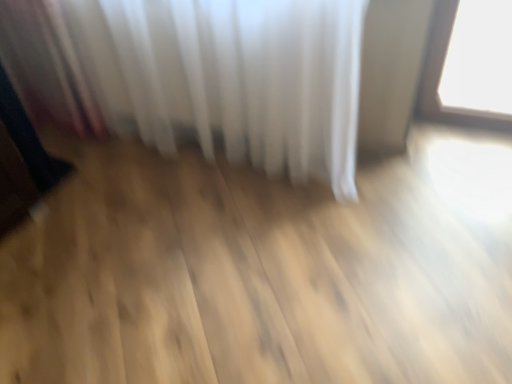
Question: From a real-world perspective, is metallic reflective object at left physically located above or below white sheer curtain at upper center?

Choices:
 (A) below
 (B) above

Answer: (A)

Question: In terms of height, does metallic reflective object at left look taller or shorter compared to white sheer curtain at upper center?

Choices:
 (A) tall
 (B) short

Answer: (B)

Question: Does point (10, 210) appear closer or farther from the camera than point (229, 46)?

Choices:
 (A) closer
 (B) farther

Answer: (B)

Question: Would you say white sheer curtain at upper center is to the left or to the right of metallic reflective object at left in the picture?

Choices:
 (A) left
 (B) right

Answer: (B)

Question: In terms of width, does white sheer curtain at upper center look wider or thinner when compared to metallic reflective object at left?

Choices:
 (A) thin
 (B) wide

Answer: (B)

Question: Considering the positions of white sheer curtain at upper center and metallic reflective object at left in the image, is white sheer curtain at upper center bigger or smaller than metallic reflective object at left?

Choices:
 (A) small
 (B) big

Answer: (B)

Question: Considering the positions of white sheer curtain at upper center and metallic reflective object at left in the image, is white sheer curtain at upper center taller or shorter than metallic reflective object at left?

Choices:
 (A) short
 (B) tall

Answer: (B)